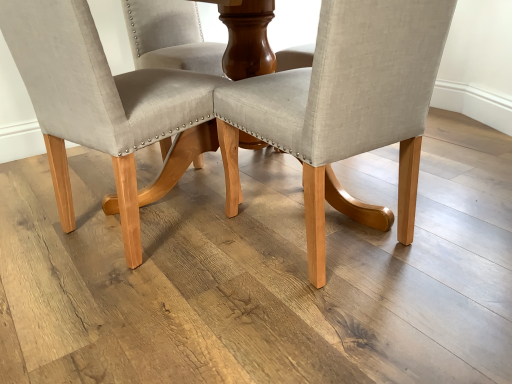
The width and height of the screenshot is (512, 384). Find the location of `vacant space underneath beige fabric chair at center, the 2th chair from the right (from a real-world perspective)`. vacant space underneath beige fabric chair at center, the 2th chair from the right (from a real-world perspective) is located at coordinates (163, 221).